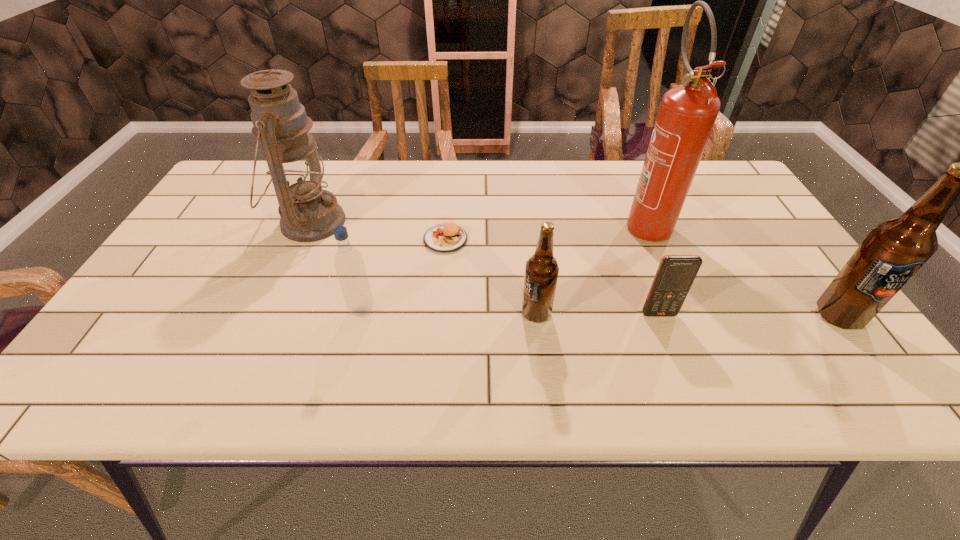
Identify the location of oil lamp present at the far edge. (309, 213).

I want to click on object at the right edge, so click(894, 250).

I want to click on object located at the near right corner, so click(x=894, y=250).

In the image, there is a desktop. Where is `vacant space at the far edge`? Image resolution: width=960 pixels, height=540 pixels. vacant space at the far edge is located at coordinates (497, 168).

This screenshot has height=540, width=960. In the image, there is a desktop. Find the location of `free space at the near edge`. free space at the near edge is located at coordinates (356, 331).

Locate an element on the screen. The width and height of the screenshot is (960, 540). free region at the left edge of the desktop is located at coordinates (142, 318).

Identify the location of free region at the right edge of the desktop. (760, 286).

This screenshot has height=540, width=960. In the image, there is a desktop. Find the location of `vacant space at the far right corner`. vacant space at the far right corner is located at coordinates (715, 186).

At what (x,y) coordinates should I click in order to perform the action: click on unoccupied area between the leftmost object and the shortest object. Please return your answer as a coordinate pair (x, y). Looking at the image, I should click on (377, 231).

Identify the location of free space between the tallest object and the fourth object from left to right. (590, 268).